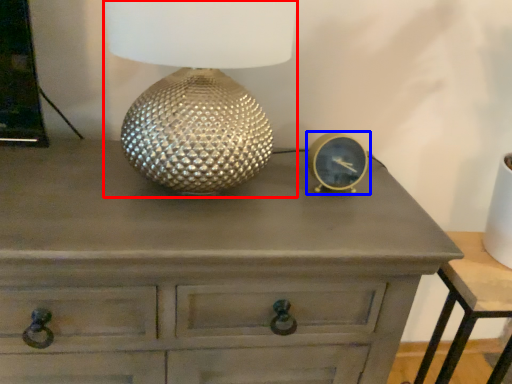
Question: Which point is further to the camera, table lamp (highlighted by a red box) or pocket watch (highlighted by a blue box)?

Choices:
 (A) table lamp
 (B) pocket watch

Answer: (B)